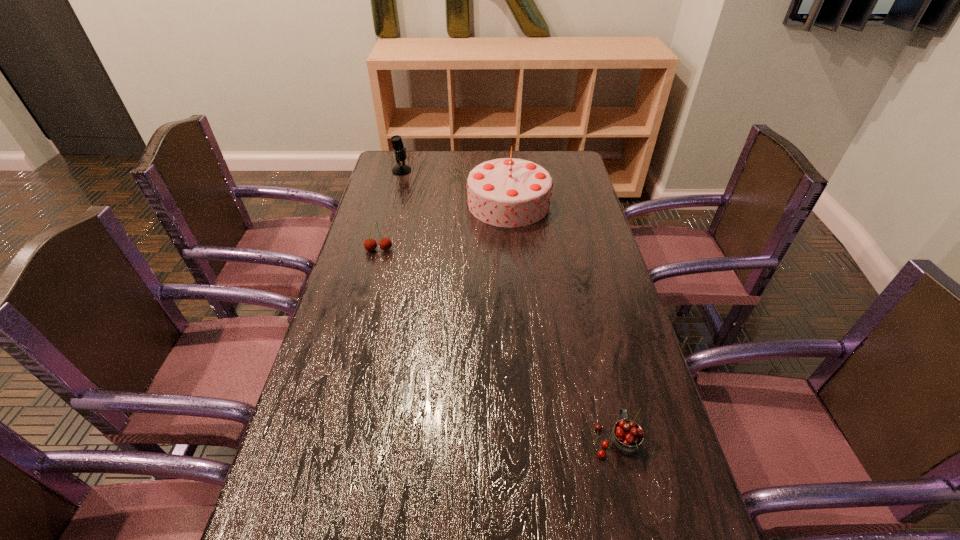
The image size is (960, 540). Find the location of `vacant region located 0.380m on the surface of the second nearest object`. vacant region located 0.380m on the surface of the second nearest object is located at coordinates (352, 350).

At what (x,y) coordinates should I click in order to perform the action: click on vacant point located 0.130m on the handle side of the shortest object. Please return your answer as a coordinate pair (x, y). Looking at the image, I should click on (599, 371).

The height and width of the screenshot is (540, 960). What are the coordinates of `free space located 0.400m on the handle side of the shortest object` in the screenshot? It's located at (581, 293).

In order to click on blank space located on the handle side of the shortest object in this screenshot , I will do `click(590, 333)`.

Find the location of `object present at the far edge`. object present at the far edge is located at coordinates (401, 169).

This screenshot has width=960, height=540. I want to click on microphone situated at the left edge, so click(x=401, y=169).

The image size is (960, 540). What are the coordinates of `cherry that is at the left edge` in the screenshot? It's located at (370, 244).

This screenshot has width=960, height=540. I want to click on birthday cake that is at the right edge, so click(507, 192).

This screenshot has width=960, height=540. Find the location of `cherry at the right edge`. cherry at the right edge is located at coordinates (626, 437).

I want to click on object that is positioned at the far left corner, so click(x=401, y=169).